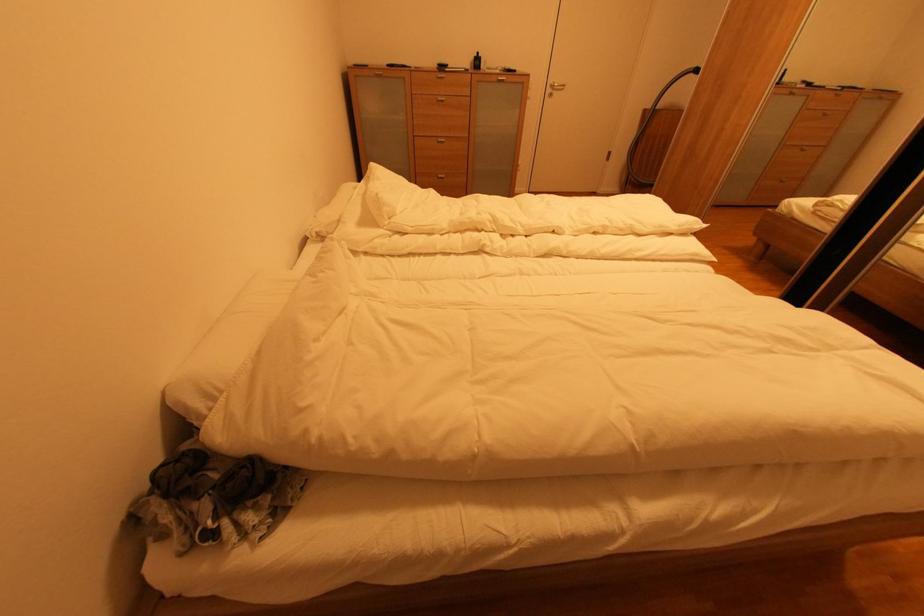
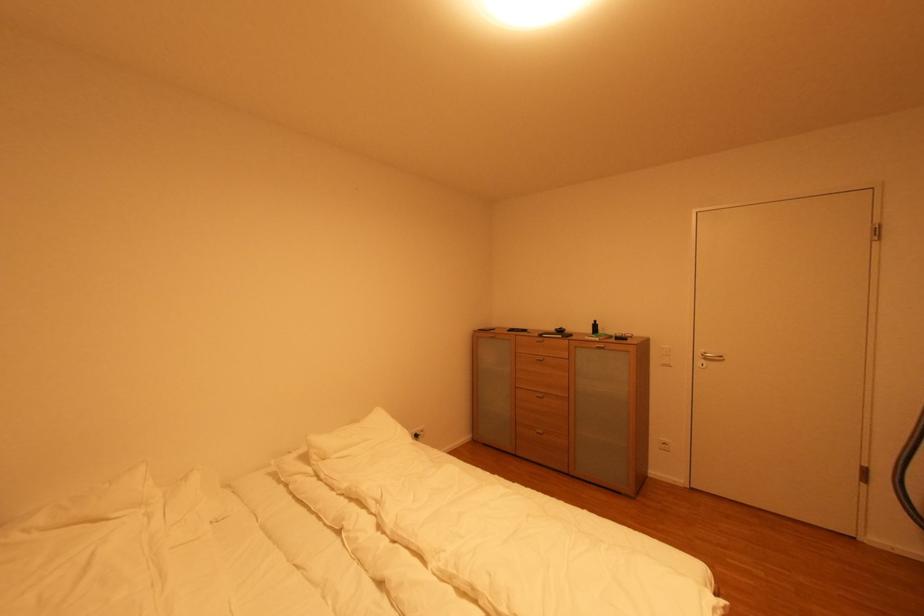
Locate, in the second image, the point that corresponds to [395,219] in the first image.

(330, 461)